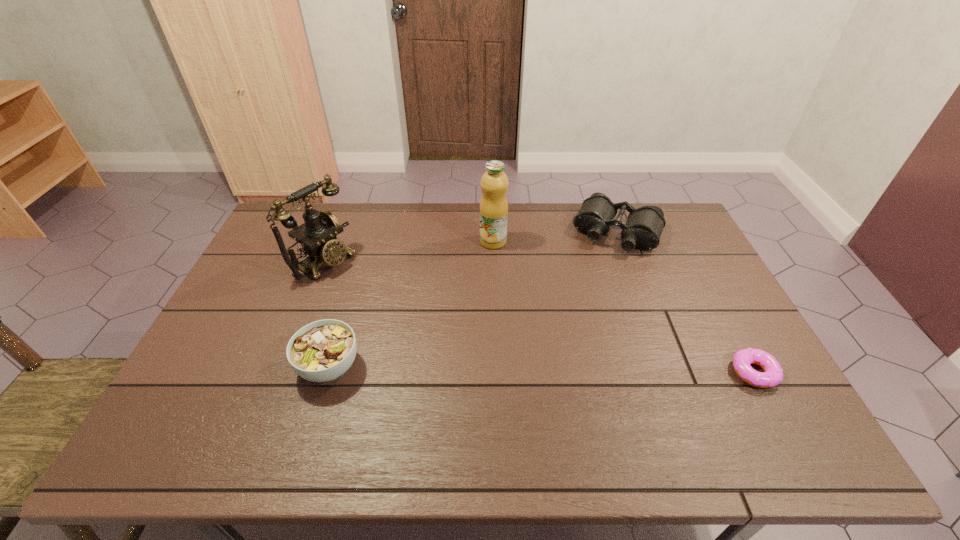
This screenshot has width=960, height=540. What are the coordinates of `vacant space at the right edge` in the screenshot? It's located at (736, 327).

Locate an element on the screen. free space between the doughnut and the telephone is located at coordinates (540, 317).

What are the coordinates of `free spot between the third object from right to left and the telephone` in the screenshot? It's located at (409, 251).

This screenshot has width=960, height=540. Identify the location of empty space between the doughnut and the telephone. (540, 317).

I want to click on vacant area between the soup bowl and the third object from left to right, so click(411, 304).

Image resolution: width=960 pixels, height=540 pixels. I want to click on vacant space that's between the fruit juice and the binoculars, so click(555, 237).

This screenshot has height=540, width=960. What are the coordinates of `vacant space that's between the soup bowl and the binoculars` in the screenshot? It's located at (473, 299).

The height and width of the screenshot is (540, 960). What are the coordinates of `free space between the shortest object and the telephone` in the screenshot? It's located at (540, 317).

Identify the location of free space between the fruit juice and the binoculars. (555, 237).

Image resolution: width=960 pixels, height=540 pixels. In order to click on free space between the soup bowl and the third object from right to left in this screenshot , I will do `click(411, 304)`.